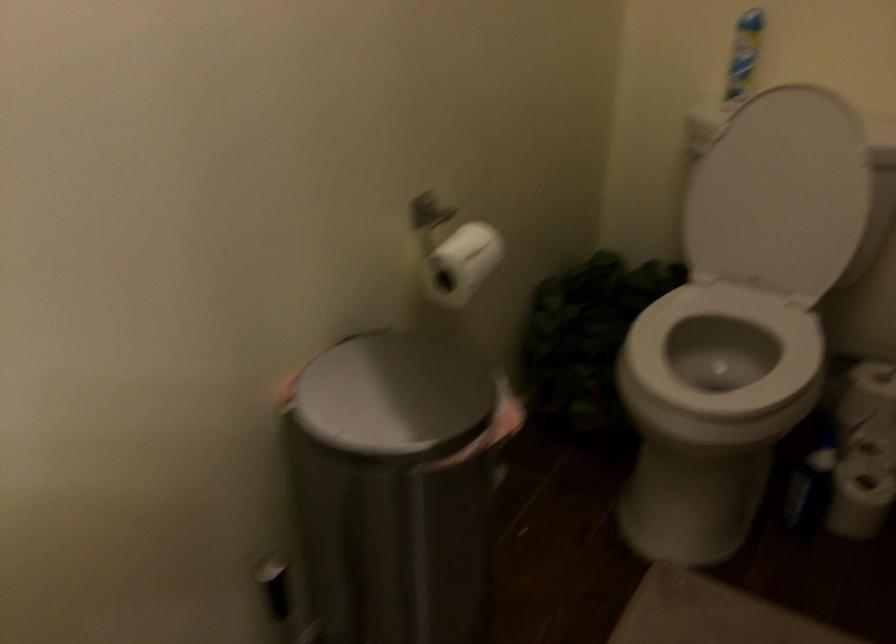
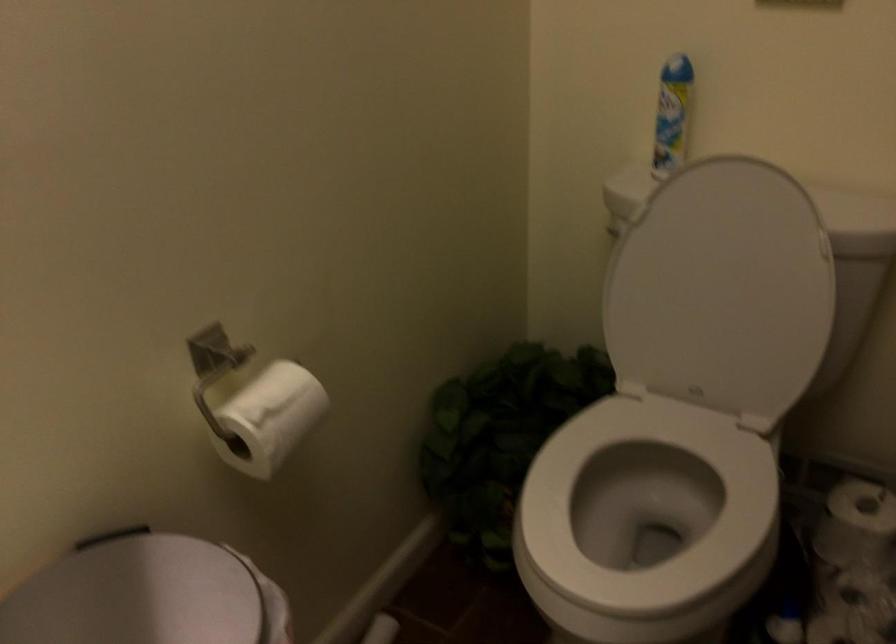
Where in the second image is the point corresponding to (x=711, y=382) from the first image?

(645, 516)